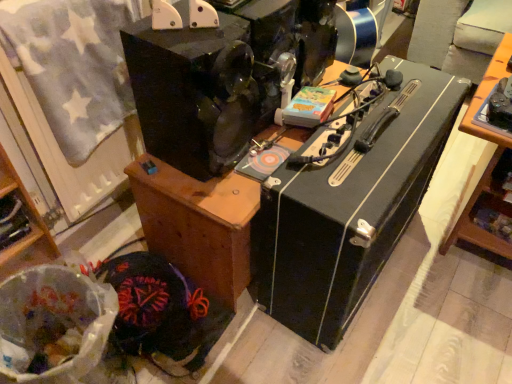
Describe the element at coordinates (54, 324) in the screenshot. I see `translucent plastic bag at lower left, which is the first waste in front-to-back order` at that location.

The image size is (512, 384). Describe the element at coordinates (350, 203) in the screenshot. I see `black hard case at center` at that location.

Describe the element at coordinates (198, 224) in the screenshot. Image resolution: width=512 pixels, height=384 pixels. I see `black matte speaker at center, the 1th furniture from the right` at that location.

Identify the location of velvet-like fabric at lower left, which is the first waste in back-to-front order. (162, 310).

You are a GUI agent. You are given a task and a screenshot of the screen. Output one action in this format:
    pyautogui.click(x=<x>, y=<y>)
    Task: Click on the wooden cabinet at lower left, marked as the second furniture in a right-to-left arrangement
    The image size is (512, 384).
    Given the screenshot: What is the action you would take?
    pyautogui.click(x=31, y=227)

Where is `translucent plastic bag at lower left, which is the first waste in front-to-back order`? translucent plastic bag at lower left, which is the first waste in front-to-back order is located at coordinates (54, 324).

Would you say black hard case at center is a long distance from translucent plastic bag at lower left, placed as the second waste when sorted from back to front?

Actually, black hard case at center and translucent plastic bag at lower left, placed as the second waste when sorted from back to front, are a little close together.

Does point (384, 249) lie in front of point (42, 333)?

No, it is not.

Does black hard case at center appear on the right side of translucent plastic bag at lower left, which is the first waste in front-to-back order?

Correct, you'll find black hard case at center to the right of translucent plastic bag at lower left, which is the first waste in front-to-back order.

Which is more to the left, velvet-like fabric at lower left, the second waste viewed from the front, or black hard case at center?

Positioned to the left is velvet-like fabric at lower left, the second waste viewed from the front.

Is velvet-like fabric at lower left, the second waste viewed from the front, next to black hard case at center?

They are not placed beside each other.

From the image's perspective, is velvet-like fabric at lower left, which is the first waste in back-to-front order, under black hard case at center?

Yes.

Does velvet-like fabric at lower left, which is the first waste in back-to-front order, have a greater height compared to black hard case at center?

No, velvet-like fabric at lower left, which is the first waste in back-to-front order, is not taller than black hard case at center.

Identify the location of waste above the translucent plastic bag at lower left, placed as the second waste when sorted from back to front (from the image's perspective). This screenshot has width=512, height=384. (162, 310).

From a real-world perspective, is velvet-like fabric at lower left, the second waste viewed from the front, physically located above or below translucent plastic bag at lower left, placed as the second waste when sorted from back to front?

In terms of real-world spatial position, velvet-like fabric at lower left, the second waste viewed from the front, is below translucent plastic bag at lower left, placed as the second waste when sorted from back to front.

Can you confirm if velvet-like fabric at lower left, the second waste viewed from the front, is smaller than translucent plastic bag at lower left, placed as the second waste when sorted from back to front?

Yes, velvet-like fabric at lower left, the second waste viewed from the front, is smaller than translucent plastic bag at lower left, placed as the second waste when sorted from back to front.

How different are the orientations of velvet-like fabric at lower left, which is the first waste in back-to-front order, and translucent plastic bag at lower left, which is the first waste in front-to-back order, in degrees?

velvet-like fabric at lower left, which is the first waste in back-to-front order, and translucent plastic bag at lower left, which is the first waste in front-to-back order, are facing 31.9 degrees away from each other.

Can you confirm if black matte speaker at center, the 1th furniture from the right, is smaller than velvet-like fabric at lower left, which is the first waste in back-to-front order?

Incorrect, black matte speaker at center, the 1th furniture from the right, is not smaller in size than velvet-like fabric at lower left, which is the first waste in back-to-front order.

Which is less distant, (214, 287) or (200, 293)?

Point (214, 287) is closer to the camera than point (200, 293).

Would you consider black matte speaker at center, the 1th furniture from the right, to be distant from velvet-like fabric at lower left, the second waste viewed from the front?

black matte speaker at center, the 1th furniture from the right, is actually quite close to velvet-like fabric at lower left, the second waste viewed from the front.

What's the angular difference between black matte speaker at center, the 1th furniture from the right, and velvet-like fabric at lower left, which is the first waste in back-to-front order,'s facing directions?

black matte speaker at center, the 1th furniture from the right, and velvet-like fabric at lower left, which is the first waste in back-to-front order, are facing 1.59 degrees away from each other.

From the image's perspective, is black matte speaker at center, which is the 2th furniture in left-to-right order, located beneath translucent plastic bag at lower left, placed as the second waste when sorted from back to front?

No.

The width and height of the screenshot is (512, 384). Find the location of `the 1st furniture located above the translucent plastic bag at lower left, placed as the second waste when sorted from back to front (from a real-world perspective)`. the 1st furniture located above the translucent plastic bag at lower left, placed as the second waste when sorted from back to front (from a real-world perspective) is located at coordinates (198, 224).

From a real-world perspective, is black matte speaker at center, the 1th furniture from the right, positioned above or below translucent plastic bag at lower left, placed as the second waste when sorted from back to front?

black matte speaker at center, the 1th furniture from the right, is above translucent plastic bag at lower left, placed as the second waste when sorted from back to front.

Is black matte speaker at center, the 1th furniture from the right, oriented towards translucent plastic bag at lower left, which is the first waste in front-to-back order?

No, black matte speaker at center, the 1th furniture from the right, is not oriented towards translucent plastic bag at lower left, which is the first waste in front-to-back order.

Is black matte speaker at center, which is the 2th furniture in left-to-right order, with black hard case at center?

black matte speaker at center, which is the 2th furniture in left-to-right order, and black hard case at center are clearly separated.

Is black matte speaker at center, the 1th furniture from the right, not within black hard case at center?

Yes, black matte speaker at center, the 1th furniture from the right, is not within black hard case at center.

Which is behind, black matte speaker at center, the 1th furniture from the right, or black hard case at center?

black matte speaker at center, the 1th furniture from the right.

Can you confirm if black matte speaker at center, the 1th furniture from the right, is wider than black hard case at center?

Yes.

Locate an element on the screen. waste that is the 2nd object to the left of the black matte speaker at center, which is the 2th furniture in left-to-right order, starting at the anchor is located at coordinates (54, 324).

How much distance is there between translucent plastic bag at lower left, placed as the second waste when sorted from back to front, and black matte speaker at center, the 1th furniture from the right?

translucent plastic bag at lower left, placed as the second waste when sorted from back to front, and black matte speaker at center, the 1th furniture from the right, are 34.98 centimeters apart.

Which object is thinner, translucent plastic bag at lower left, placed as the second waste when sorted from back to front, or black matte speaker at center, which is the 2th furniture in left-to-right order?

translucent plastic bag at lower left, placed as the second waste when sorted from back to front.

Considering the relative positions of translucent plastic bag at lower left, placed as the second waste when sorted from back to front, and black matte speaker at center, the 1th furniture from the right, in the image provided, is translucent plastic bag at lower left, placed as the second waste when sorted from back to front, to the right of black matte speaker at center, the 1th furniture from the right, from the viewer's perspective?

No.

This screenshot has width=512, height=384. What are the coordinates of `waste in front of the black hard case at center` in the screenshot? It's located at tap(54, 324).

There is a black hard case at center. In order to click on the 1st waste below it (from the image's perspective) in this screenshot , I will do [x=162, y=310].

Based on their spatial positions, is wooden cabinet at lower left, placed as the first furniture when sorted from left to right, or velvet-like fabric at lower left, the second waste viewed from the front, closer to black hard case at center?

velvet-like fabric at lower left, the second waste viewed from the front, is positioned closer to the anchor black hard case at center.

Based on the photo, when comparing their distances from velvet-like fabric at lower left, the second waste viewed from the front, does black matte speaker at center, which is the 2th furniture in left-to-right order, or translucent plastic bag at lower left, which is the first waste in front-to-back order, seem further?

Among the two, translucent plastic bag at lower left, which is the first waste in front-to-back order, is located further to velvet-like fabric at lower left, the second waste viewed from the front.

Looking at the image, which one is located further to black matte speaker at center, which is the 2th furniture in left-to-right order, black hard case at center or wooden cabinet at lower left, marked as the second furniture in a right-to-left arrangement?

wooden cabinet at lower left, marked as the second furniture in a right-to-left arrangement, lies further to black matte speaker at center, which is the 2th furniture in left-to-right order, than the other object.

From the image, which object appears to be nearer to velvet-like fabric at lower left, which is the first waste in back-to-front order, wooden cabinet at lower left, marked as the second furniture in a right-to-left arrangement, or black matte speaker at center, the 1th furniture from the right?

black matte speaker at center, the 1th furniture from the right, is closer to velvet-like fabric at lower left, which is the first waste in back-to-front order.

Which object lies nearer to the anchor point wooden cabinet at lower left, placed as the first furniture when sorted from left to right, translucent plastic bag at lower left, placed as the second waste when sorted from back to front, or velvet-like fabric at lower left, the second waste viewed from the front?

translucent plastic bag at lower left, placed as the second waste when sorted from back to front, lies closer to wooden cabinet at lower left, placed as the first furniture when sorted from left to right, than the other object.

Looking at the image, which one is located further to black hard case at center, wooden cabinet at lower left, placed as the first furniture when sorted from left to right, or black matte speaker at center, the 1th furniture from the right?

wooden cabinet at lower left, placed as the first furniture when sorted from left to right.

Based on their spatial positions, is black matte speaker at center, the 1th furniture from the right, or black hard case at center closer to wooden cabinet at lower left, marked as the second furniture in a right-to-left arrangement?

black matte speaker at center, the 1th furniture from the right, is closer to wooden cabinet at lower left, marked as the second furniture in a right-to-left arrangement.

From the image, which object appears to be nearer to velvet-like fabric at lower left, which is the first waste in back-to-front order, wooden cabinet at lower left, placed as the first furniture when sorted from left to right, or black hard case at center?

wooden cabinet at lower left, placed as the first furniture when sorted from left to right, is closer to velvet-like fabric at lower left, which is the first waste in back-to-front order.

Identify the location of waste that lies between black matte speaker at center, which is the 2th furniture in left-to-right order, and translucent plastic bag at lower left, placed as the second waste when sorted from back to front, from top to bottom. The width and height of the screenshot is (512, 384). (162, 310).

I want to click on furniture situated between wooden cabinet at lower left, marked as the second furniture in a right-to-left arrangement, and black hard case at center from left to right, so click(198, 224).

Image resolution: width=512 pixels, height=384 pixels. I want to click on furniture located between translucent plastic bag at lower left, placed as the second waste when sorted from back to front, and black hard case at center in the left-right direction, so click(x=198, y=224).

Where is `waste between translucent plastic bag at lower left, which is the first waste in front-to-back order, and black hard case at center`? This screenshot has height=384, width=512. waste between translucent plastic bag at lower left, which is the first waste in front-to-back order, and black hard case at center is located at coordinates (162, 310).